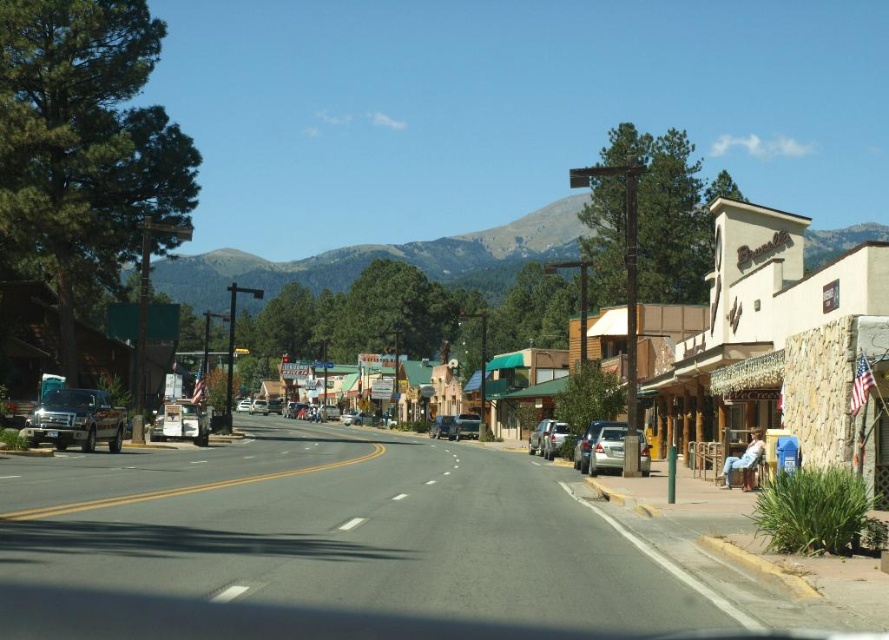
Can you confirm if stone building at center is positioned above metallic silver sedan at center-right?

Indeed, stone building at center is positioned over metallic silver sedan at center-right.

The height and width of the screenshot is (640, 889). What are the coordinates of `stone building at center` in the screenshot? It's located at (761, 301).

The image size is (889, 640). What do you see at coordinates (761, 301) in the screenshot? I see `stone building at center` at bounding box center [761, 301].

Locate an element on the screen. stone building at center is located at coordinates [761, 301].

Is point (733, 304) farther from viewer compared to point (47, 396)?

That is True.

Between stone building at center and silver metallic truck at left, which one is positioned higher?

stone building at center is higher up.

What are the coordinates of `stone building at center` in the screenshot? It's located at (761, 301).

Who is taller, silver metallic truck at left or silver metallic sedan at center?

With more height is silver metallic sedan at center.

Does point (115, 420) come in front of point (343, 417)?

Yes, point (115, 420) is closer to viewer.

I want to click on silver metallic truck at left, so click(75, 419).